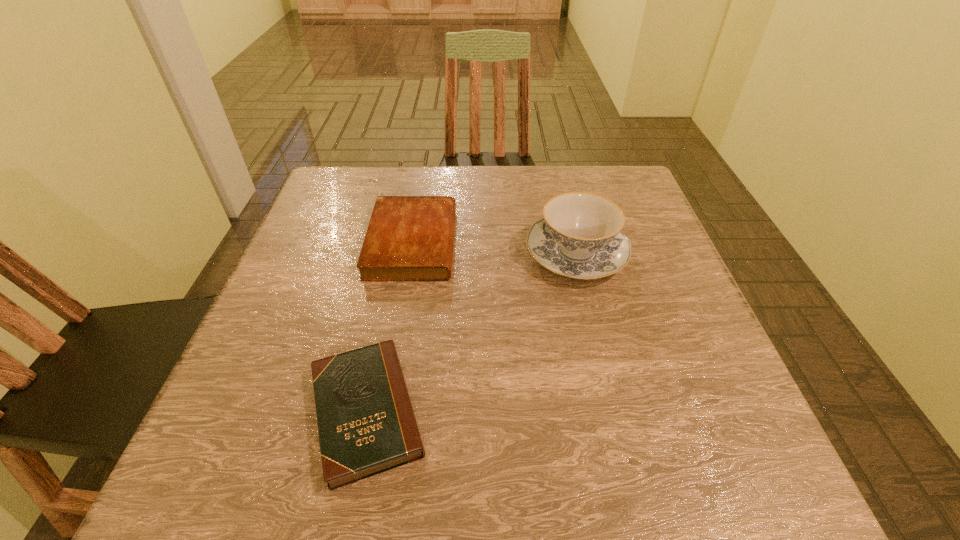
Where is `vacant position at the far left corner of the desktop`? vacant position at the far left corner of the desktop is located at coordinates (368, 177).

Identify the location of free point at the far right corner. The width and height of the screenshot is (960, 540). (628, 173).

In the image, there is a desktop. At what (x,y) coordinates should I click in order to perform the action: click on free space at the near right corner. Please return your answer as a coordinate pair (x, y). The image size is (960, 540). Looking at the image, I should click on pos(702,453).

Image resolution: width=960 pixels, height=540 pixels. Find the location of `vacant point located between the tallest object and the shorter Bible`. vacant point located between the tallest object and the shorter Bible is located at coordinates (471, 333).

Identify the location of empty location between the farther Bible and the nearer Bible. (390, 327).

Where is `blank region between the shortest object and the farther Bible`? blank region between the shortest object and the farther Bible is located at coordinates (390, 327).

Locate an element on the screen. This screenshot has height=540, width=960. empty location between the shortest object and the second tallest object is located at coordinates (390, 327).

This screenshot has height=540, width=960. I want to click on free space between the shortest object and the taller Bible, so click(x=390, y=327).

At what (x,y) coordinates should I click in order to perform the action: click on vacant space in between the shorter Bible and the farther Bible. Please return your answer as a coordinate pair (x, y). Looking at the image, I should click on (390, 327).

Identify the location of free point between the shortest object and the chinaware. The width and height of the screenshot is (960, 540). [471, 333].